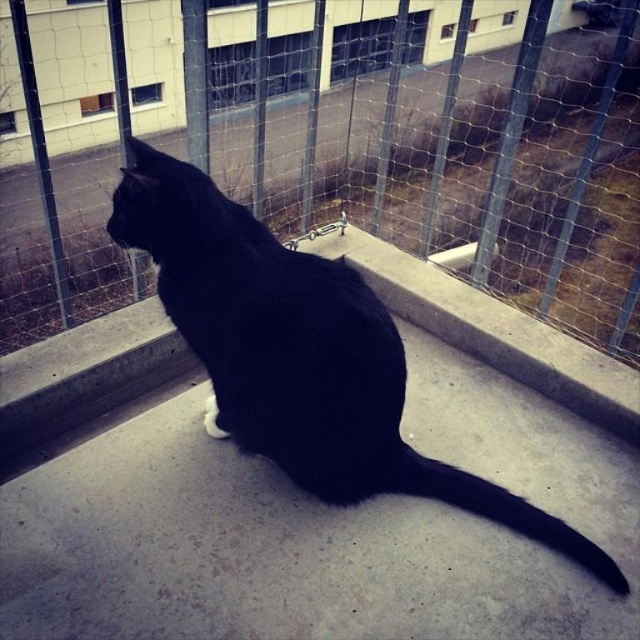
Question: Is metal mesh fence at upper center bigger than black matte fur cat at center?

Choices:
 (A) yes
 (B) no

Answer: (A)

Question: Is metal mesh fence at upper center further to camera compared to black matte fur cat at center?

Choices:
 (A) no
 (B) yes

Answer: (B)

Question: In this image, where is metal mesh fence at upper center located relative to black matte fur cat at center?

Choices:
 (A) below
 (B) above

Answer: (B)

Question: Which point is closer to the camera?

Choices:
 (A) black matte fur cat at center
 (B) metal mesh fence at upper center

Answer: (A)

Question: Among these points, which one is nearest to the camera?

Choices:
 (A) (240, 96)
 (B) (324, 269)

Answer: (B)